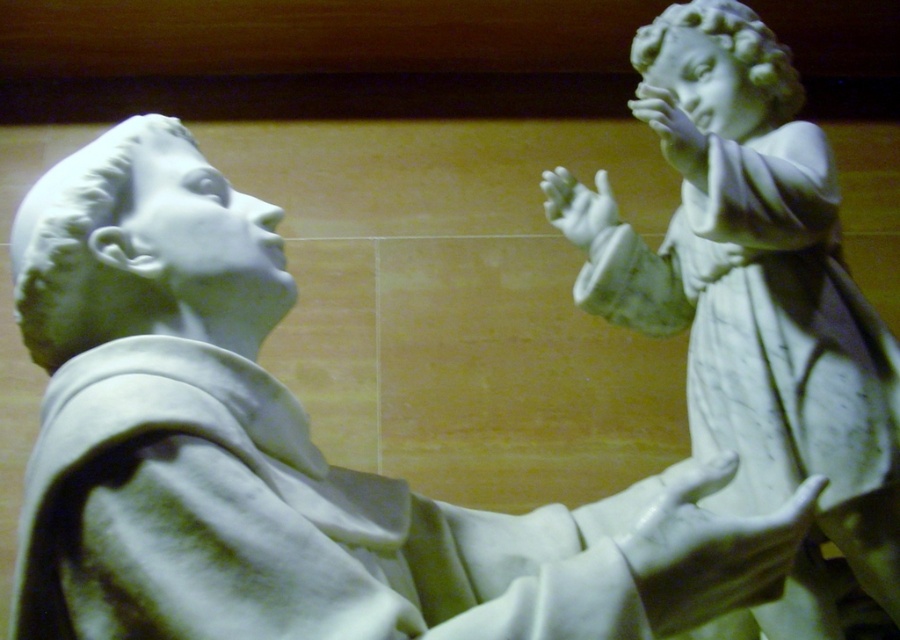
Question: Which object is closer to the camera taking this photo?

Choices:
 (A) white marble statue at right
 (B) white marble hand at center
 (C) white marble hand at lower right
 (D) white marble hand at upper right

Answer: (C)

Question: Does white marble hand at center lie in front of white marble hand at upper right?

Choices:
 (A) yes
 (B) no

Answer: (B)

Question: Which object appears farthest from the camera in this image?

Choices:
 (A) white marble hand at upper right
 (B) white marble statue at right

Answer: (A)

Question: Which object appears closest to the camera in this image?

Choices:
 (A) white marble hand at upper right
 (B) white marble hand at lower right

Answer: (B)

Question: Is white marble statue at right thinner than white marble hand at upper right?

Choices:
 (A) no
 (B) yes

Answer: (A)

Question: Is white marble statue at right closer to camera compared to white marble hand at center?

Choices:
 (A) yes
 (B) no

Answer: (A)